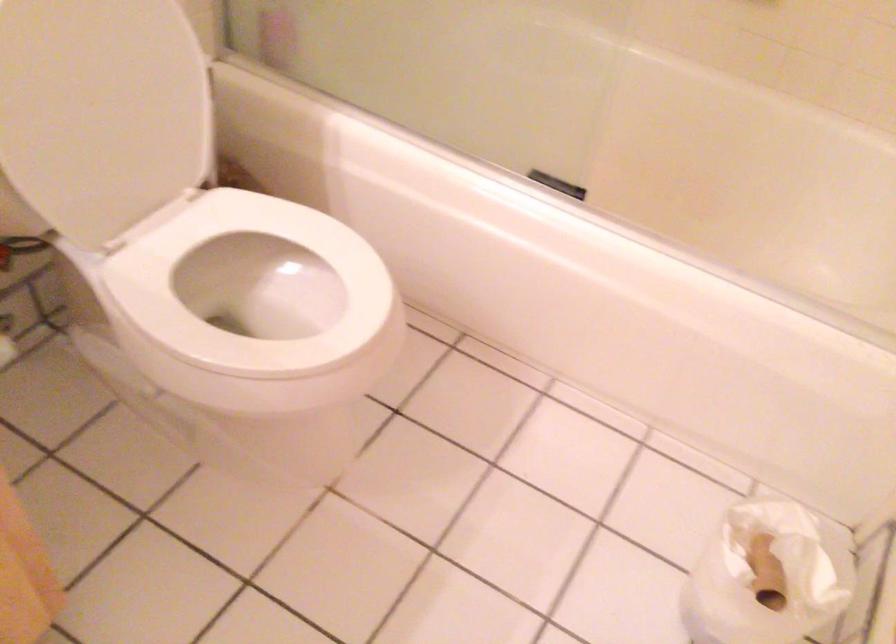
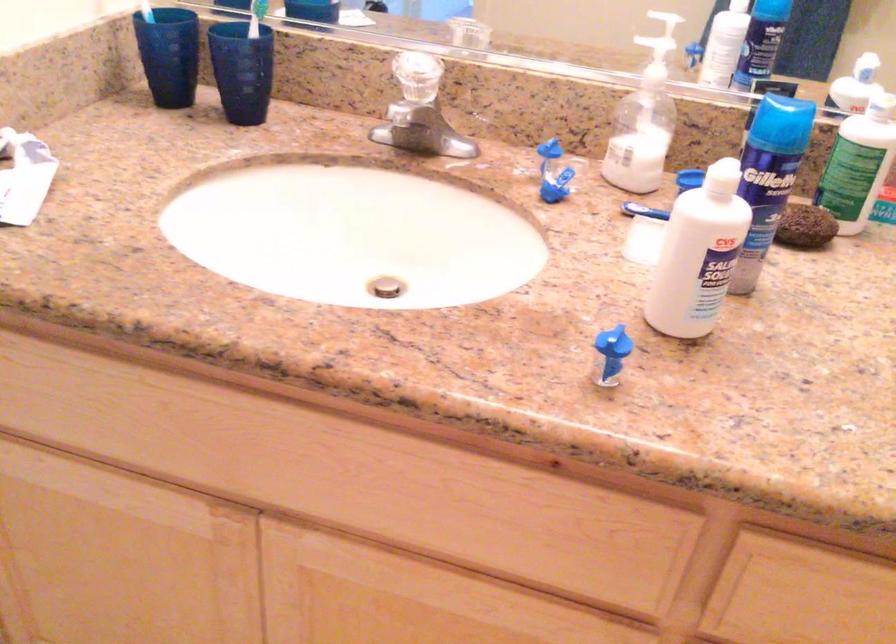
Question: The first image is from the beginning of the video and the second image is from the end. How did the camera likely rotate when shooting the video?

Choices:
 (A) Left
 (B) Right
 (C) Up
 (D) Down

Answer: (A)